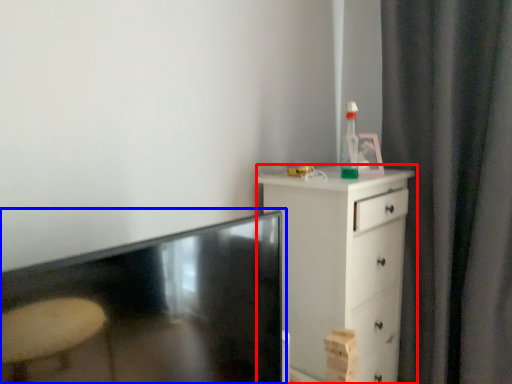
Question: Among these objects, which one is farthest to the camera, chest of drawers (highlighted by a red box) or table (highlighted by a blue box)?

Choices:
 (A) chest of drawers
 (B) table

Answer: (A)